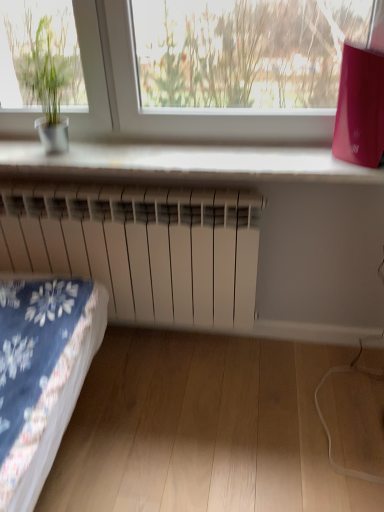
Question: Would you say green matte plant pot at left is to the left or to the right of white matte radiator at center in the picture?

Choices:
 (A) left
 (B) right

Answer: (A)

Question: Is green matte plant pot at left bigger or smaller than white matte radiator at center?

Choices:
 (A) small
 (B) big

Answer: (A)

Question: Which object is positioned closest to the white plastic radiator at lower center?

Choices:
 (A) white matte radiator at center
 (B) green matte plant pot at left

Answer: (A)

Question: Which object is positioned farthest from the white plastic radiator at lower center?

Choices:
 (A) green matte plant pot at left
 (B) white matte radiator at center

Answer: (A)